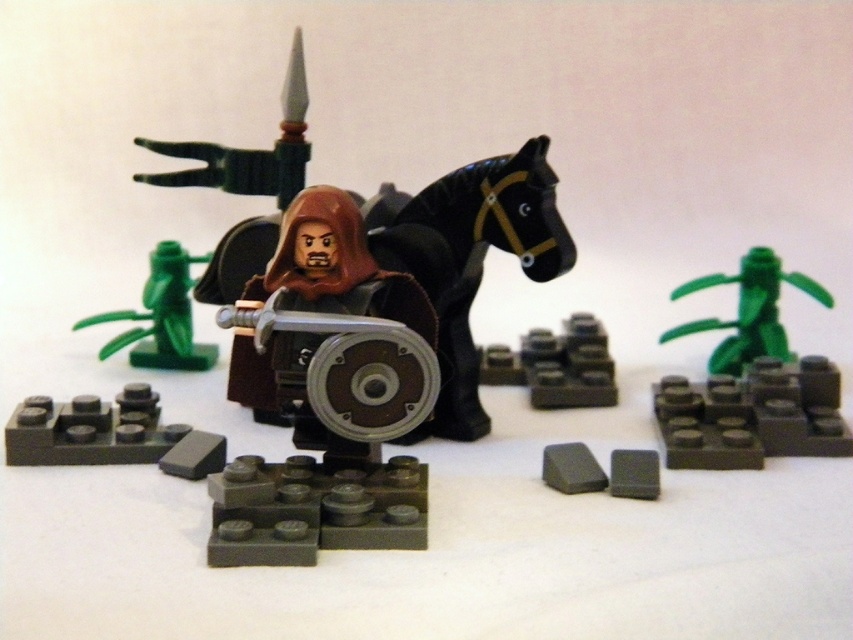
Question: Can you confirm if brown matte minifigure at center is positioned below green matte plant at center?

Choices:
 (A) yes
 (B) no

Answer: (A)

Question: Is black matte horse at center positioned behind green matte plant at center?

Choices:
 (A) no
 (B) yes

Answer: (A)

Question: Estimate the real-world distances between objects in this image. Which object is farther from the green matte plant at center?

Choices:
 (A) green plastic plant at lower left
 (B) brown matte minifigure at center
 (C) smooth gray brick at center
 (D) matte gray brick at lower right

Answer: (A)

Question: Which of the following is the farthest from the observer?

Choices:
 (A) (192, 260)
 (B) (544, 230)
 (C) (633, 458)
 (D) (343, 292)

Answer: (A)

Question: Which point is farther to the camera?

Choices:
 (A) (816, 300)
 (B) (610, 481)

Answer: (A)

Question: Is green plastic plant at lower left behind matte gray brick at lower right?

Choices:
 (A) no
 (B) yes

Answer: (B)